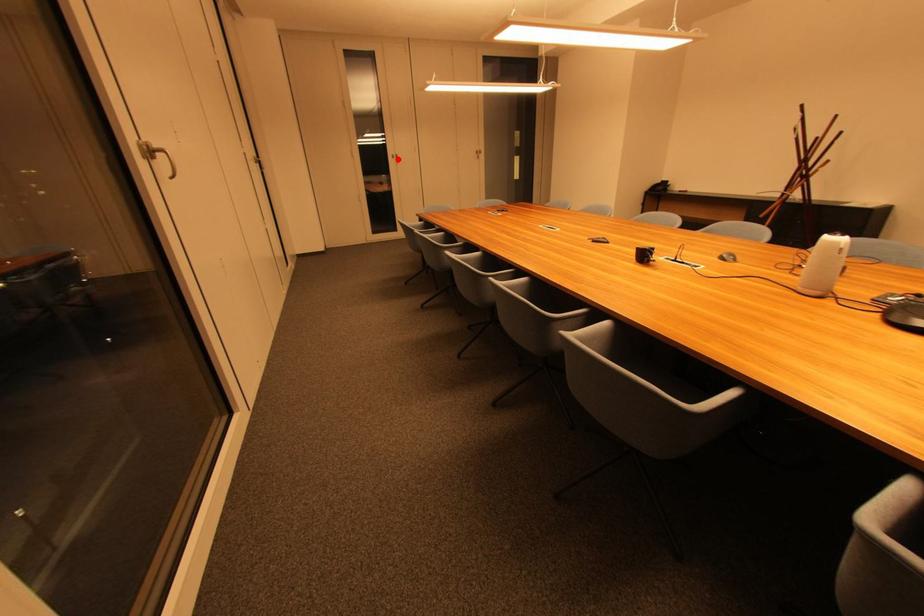
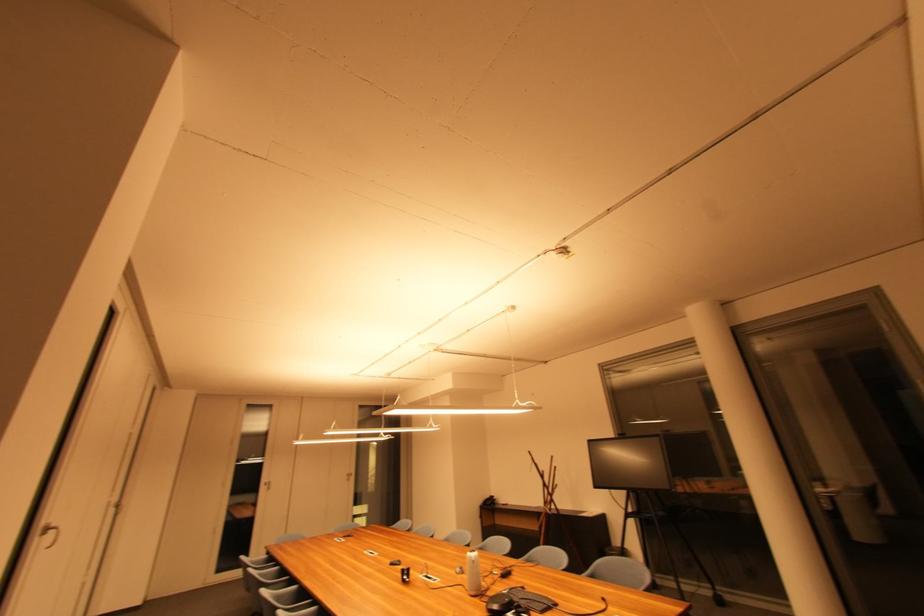
In the second image, find the point that corresponds to the highlighted location in the first image.

(271, 485)